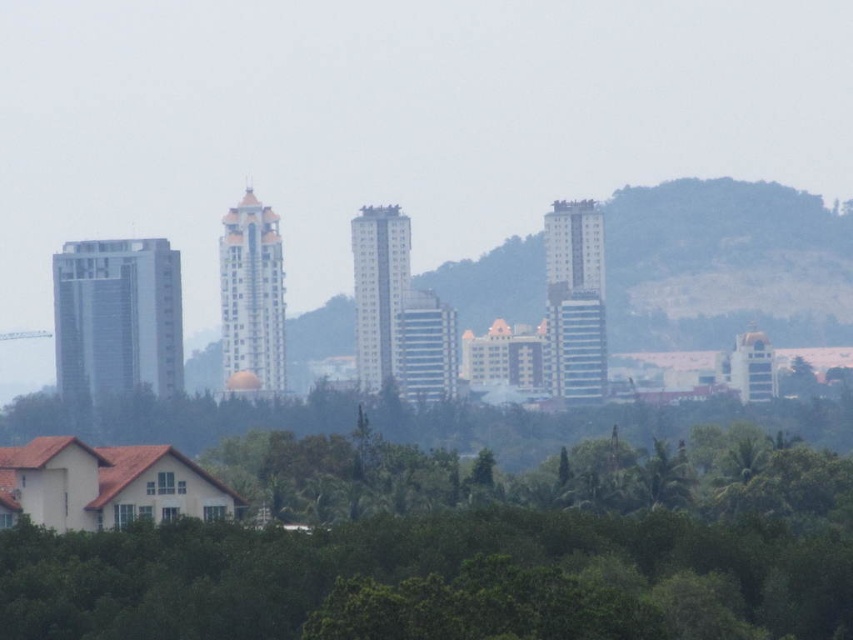
Question: Among these objects, which one is nearest to the camera?

Choices:
 (A) green grassy hillside at center
 (B) green leafy trees at lower center

Answer: (B)

Question: Does green leafy trees at lower center appear over green grassy hillside at center?

Choices:
 (A) no
 (B) yes

Answer: (A)

Question: Which object is closer to the camera taking this photo?

Choices:
 (A) green grassy hillside at center
 (B) green leafy trees at lower center

Answer: (B)

Question: Can you confirm if green leafy trees at lower center is positioned to the right of green grassy hillside at center?

Choices:
 (A) no
 (B) yes

Answer: (A)

Question: Which object is farther from the camera taking this photo?

Choices:
 (A) green leafy trees at lower center
 (B) green grassy hillside at center

Answer: (B)

Question: Is green leafy trees at lower center positioned at the back of green grassy hillside at center?

Choices:
 (A) yes
 (B) no

Answer: (B)